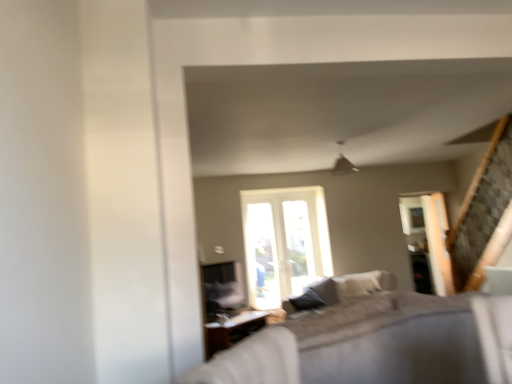
Where is `clear glass screen door at right`? Image resolution: width=512 pixels, height=384 pixels. clear glass screen door at right is located at coordinates (429, 237).

Where is `wooden table at lower center`? The width and height of the screenshot is (512, 384). wooden table at lower center is located at coordinates (232, 330).

Identify the location of textured beige couch at center. (353, 286).

At what (x,y) coordinates should I click in order to perform the action: click on clear glass screen door at right. Please return your answer as a coordinate pair (x, y). This screenshot has width=512, height=384. Looking at the image, I should click on (429, 237).

From the image's perspective, would you say clear glass screen door at right is shown under textured beige couch at center?

No, from the image's perspective, clear glass screen door at right is not beneath textured beige couch at center.

In the image, is clear glass screen door at right positioned in front of or behind textured beige couch at center?

clear glass screen door at right is behind textured beige couch at center.

Is clear glass screen door at right thinner than textured beige couch at center?

Indeed, clear glass screen door at right has a lesser width compared to textured beige couch at center.

Find the location of a particular element. This screenshot has width=512, height=384. screen door above the textured beige couch at center (from a real-world perspective) is located at coordinates (429, 237).

Would you say wooden table at lower center is outside clear glass screen door at right?

wooden table at lower center lies outside clear glass screen door at right's area.

Is wooden table at lower center turned away from clear glass screen door at right?

No, wooden table at lower center's orientation is not away from clear glass screen door at right.

Does wooden table at lower center have a lesser width compared to clear glass screen door at right?

Incorrect, the width of wooden table at lower center is not less than that of clear glass screen door at right.

Considering their positions, is textured beige couch at center located in front of or behind wooden table at lower center?

textured beige couch at center is positioned closer to the viewer than wooden table at lower center.

From the image's perspective, is textured beige couch at center above or below wooden table at lower center?

Based on their image positions, textured beige couch at center is located above wooden table at lower center.

Consider the image. Is textured beige couch at center in contact with wooden table at lower center?

No, textured beige couch at center is not with wooden table at lower center.

How different are the orientations of textured beige couch at center and wooden table at lower center in degrees?

They differ by 95.6 degrees in their facing directions.

Considering the sizes of objects wooden table at lower center and textured beige couch at center in the image provided, who is smaller, wooden table at lower center or textured beige couch at center?

wooden table at lower center is smaller.

Considering the points (212, 329) and (322, 300), which point is behind, point (212, 329) or point (322, 300)?

The point (322, 300) is behind.

Is wooden table at lower center next to textured beige couch at center and touching it?

No, wooden table at lower center is not next to textured beige couch at center.

Which of these two, wooden table at lower center or textured beige couch at center, is thinner?

Thinner between the two is wooden table at lower center.

Looking at this image, what's the angular difference between clear glass screen door at right and wooden table at lower center's facing directions?

The angular difference between clear glass screen door at right and wooden table at lower center is 132 degrees.

In terms of height, does clear glass screen door at right look taller or shorter compared to wooden table at lower center?

Clearly, clear glass screen door at right is taller compared to wooden table at lower center.

How distant is clear glass screen door at right from wooden table at lower center?

clear glass screen door at right and wooden table at lower center are 2.59 meters apart.

Is clear glass screen door at right thinner than wooden table at lower center?

Correct, the width of clear glass screen door at right is less than that of wooden table at lower center.

Is textured beige couch at center completely or partially outside of clear glass screen door at right?

That's correct, textured beige couch at center is outside of clear glass screen door at right.

Is textured beige couch at center facing away from clear glass screen door at right?

Yes, textured beige couch at center is facing away from clear glass screen door at right.

At what (x,y) coordinates should I click in order to perform the action: click on couch to the left of clear glass screen door at right. Please return your answer as a coordinate pair (x, y). Looking at the image, I should click on (353, 286).

Is there a large distance between textured beige couch at center and clear glass screen door at right?

No.

I want to click on screen door lying above the textured beige couch at center (from the image's perspective), so click(x=429, y=237).

The height and width of the screenshot is (384, 512). I want to click on screen door that appears on the right of wooden table at lower center, so click(x=429, y=237).

From the image, which object appears to be nearer to clear glass screen door at right, textured beige couch at center or wooden table at lower center?

Based on the image, textured beige couch at center appears to be nearer to clear glass screen door at right.

Estimate the real-world distances between objects in this image. Which object is closer to wooden table at lower center, clear glass screen door at right or textured beige couch at center?

textured beige couch at center lies closer to wooden table at lower center than the other object.

When comparing their distances from clear glass screen door at right, does wooden table at lower center or textured beige couch at center seem closer?

textured beige couch at center.

Based on their spatial positions, is textured beige couch at center or clear glass screen door at right closer to wooden table at lower center?

Among the two, textured beige couch at center is located nearer to wooden table at lower center.

Looking at the image, which one is located further to textured beige couch at center, clear glass screen door at right or wooden table at lower center?

wooden table at lower center is positioned further to the anchor textured beige couch at center.

Looking at the image, which one is located closer to textured beige couch at center, wooden table at lower center or clear glass screen door at right?

Based on the image, clear glass screen door at right appears to be nearer to textured beige couch at center.

You are a GUI agent. You are given a task and a screenshot of the screen. Output one action in this format:
    pyautogui.click(x=<x>, y=<y>)
    Task: Click on the couch between wooden table at lower center and clear glass screen door at right in the horizontal direction
    The height and width of the screenshot is (384, 512).
    Given the screenshot: What is the action you would take?
    pyautogui.click(x=353, y=286)